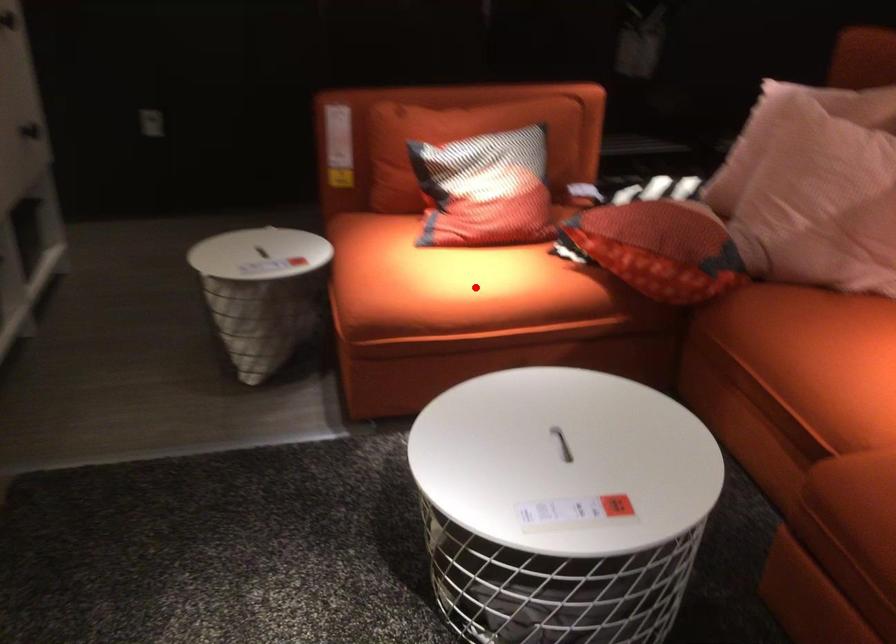
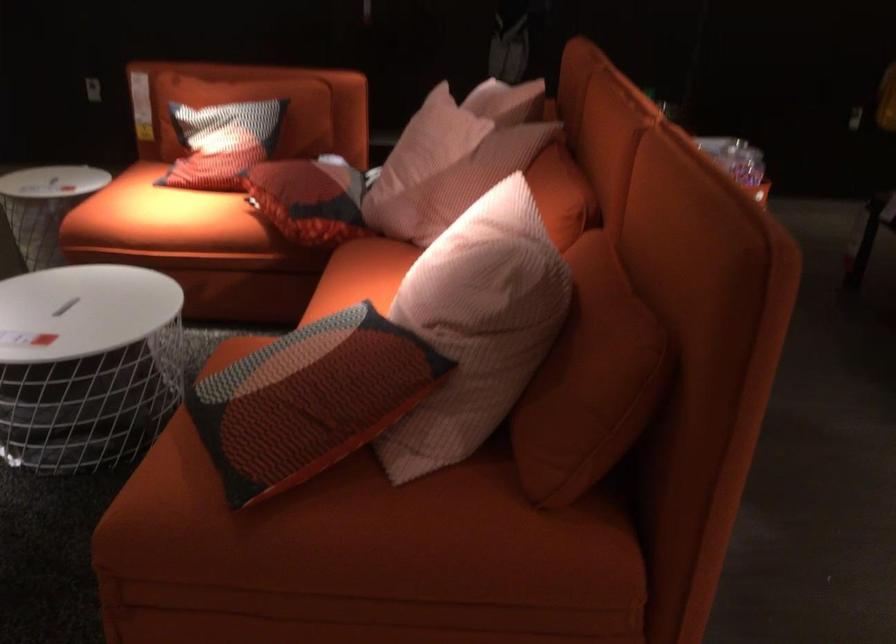
Where in the second image is the point corresponding to the highlighted location from the first image?

(160, 216)